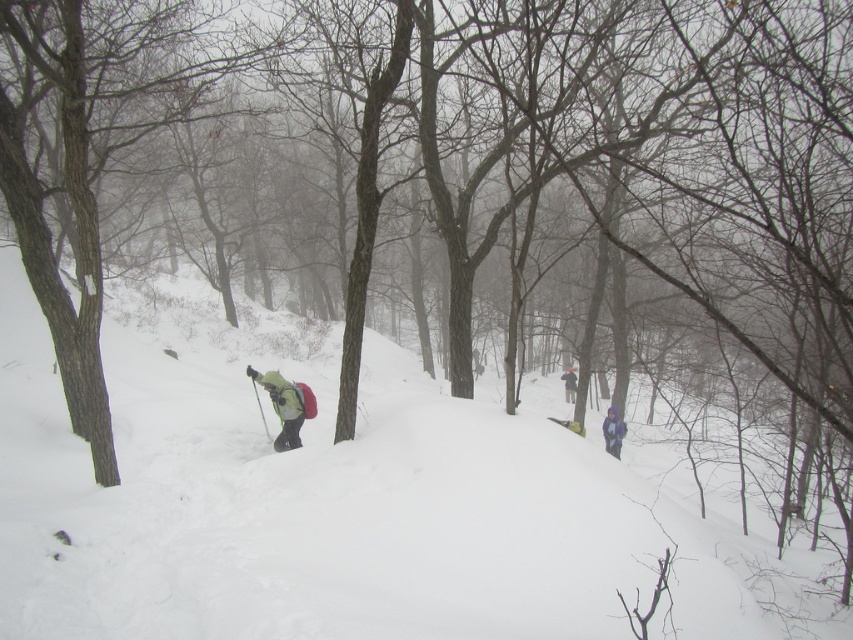
Question: Can you confirm if purple fleece jacket at lower right is bigger than purple fabric jacket at center-right?

Choices:
 (A) no
 (B) yes

Answer: (B)

Question: Which object appears farthest from the camera in this image?

Choices:
 (A) purple fleece jacket at lower right
 (B) white fluffy snow at center

Answer: (A)

Question: Does white fluffy snow at center have a lesser width compared to green matte jacket at center?

Choices:
 (A) yes
 (B) no

Answer: (B)

Question: Can you confirm if purple fleece jacket at lower right is positioned below green plastic ski at center?

Choices:
 (A) no
 (B) yes

Answer: (B)

Question: Among these objects, which one is nearest to the camera?

Choices:
 (A) purple fabric jacket at center-right
 (B) white fluffy snow at center
 (C) purple fleece jacket at lower right
 (D) green matte jacket at center

Answer: (B)

Question: Which is farther from the white fluffy snow at center?

Choices:
 (A) green plastic ski at center
 (B) green matte jacket at center

Answer: (A)